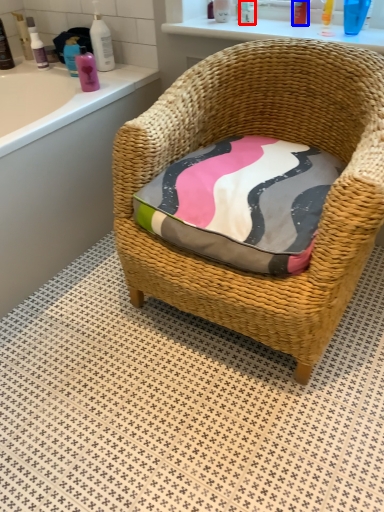
Question: Which of the following is the farthest to the observer, toiletry (highlighted by a red box) or toiletry (highlighted by a blue box)?

Choices:
 (A) toiletry
 (B) toiletry

Answer: (A)